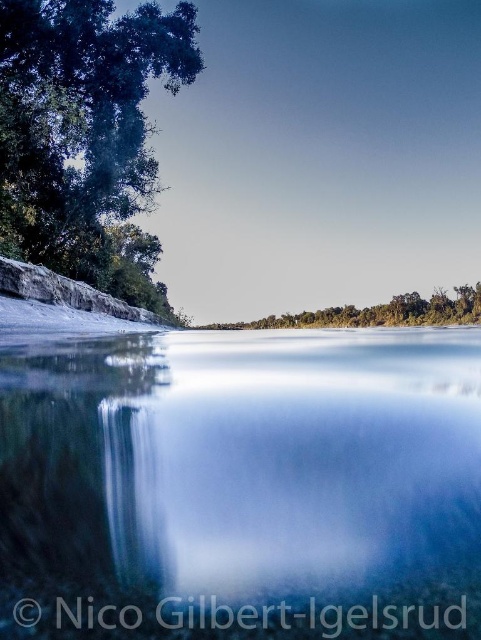
Question: Does clear glass water at center appear over green leafy tree at upper left?

Choices:
 (A) no
 (B) yes

Answer: (A)

Question: Which object is the closest to the clear glass water at center?

Choices:
 (A) green leafy tree at upper left
 (B) green leafy trees at center

Answer: (A)

Question: Which point is farther to the camera?

Choices:
 (A) green leafy trees at center
 (B) green leafy tree at upper left

Answer: (A)

Question: Which point is closer to the camera?

Choices:
 (A) clear glass water at center
 (B) green leafy trees at center
 (C) green leafy tree at upper left

Answer: (A)

Question: Does green leafy tree at upper left appear on the right side of green leafy trees at center?

Choices:
 (A) yes
 (B) no

Answer: (B)

Question: Does clear glass water at center appear on the right side of green leafy tree at upper left?

Choices:
 (A) yes
 (B) no

Answer: (A)